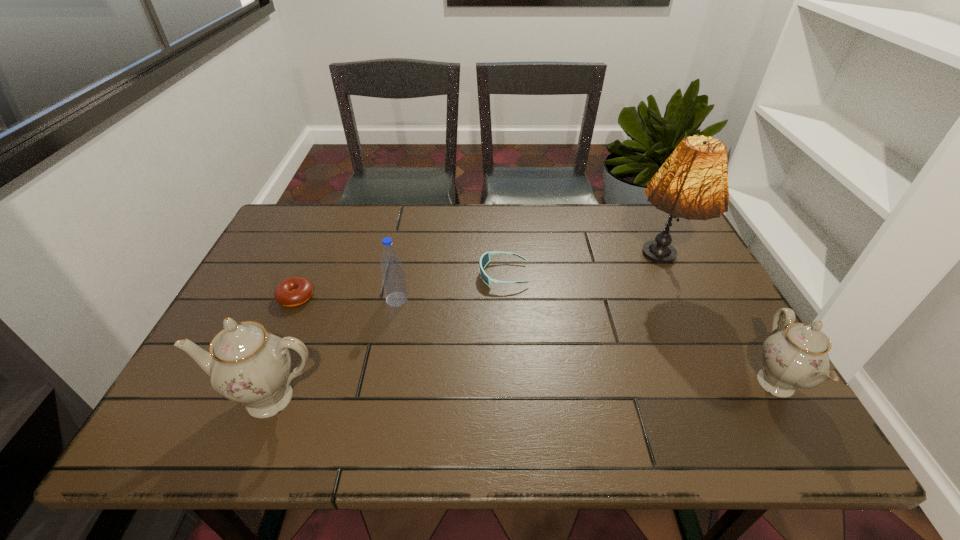
Identify the location of the taller chinaware. (246, 364).

Locate an element on the screen. the left chinaware is located at coordinates (246, 364).

The image size is (960, 540). What are the coordinates of `the right chinaware` in the screenshot? It's located at (797, 356).

Where is `goggles`? goggles is located at coordinates (485, 258).

Locate an element on the screen. The width and height of the screenshot is (960, 540). the third object from left to right is located at coordinates (393, 279).

The image size is (960, 540). In order to click on the tallest object in this screenshot , I will do `click(692, 183)`.

Where is `doughnut`? doughnut is located at coordinates (294, 291).

I want to click on free space located on the front-facing side of the third object from right to left, so tap(369, 274).

Find the location of a particular element. free region located 0.130m on the front-facing side of the third object from right to left is located at coordinates (433, 274).

Find the location of a particular element. vacant position located on the front-facing side of the third object from right to left is located at coordinates (394, 274).